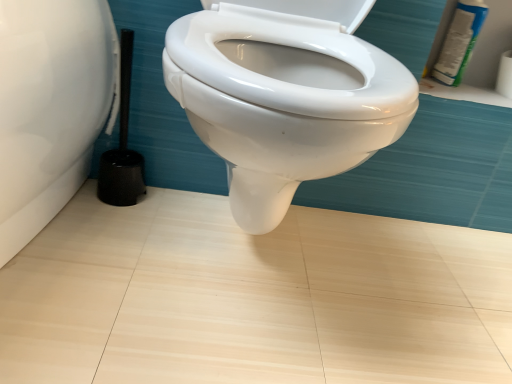
You are a GUI agent. You are given a task and a screenshot of the screen. Output one action in this format:
    pyautogui.click(x=<x>, y=<y>)
    Task: Click on the vacant area to the right of black plastic brush at left
    The image size is (512, 384).
    Given the screenshot: What is the action you would take?
    pyautogui.click(x=181, y=208)